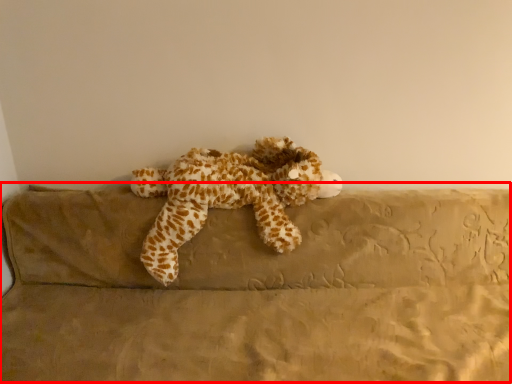
Question: From the image's perspective, where is couch (annotated by the red box) located in relation to toy in the image?

Choices:
 (A) below
 (B) above

Answer: (A)